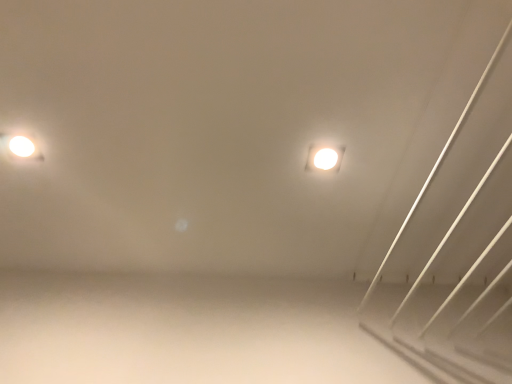
Question: Is the position of white glossy light fixture at upper center, the 1th lamp when ordered from right to left, more distant than that of matte white light fixture at upper left, which ranks as the second lamp in right-to-left order?

Choices:
 (A) no
 (B) yes

Answer: (B)

Question: Are white glossy light fixture at upper center, acting as the 2th lamp starting from the left, and matte white light fixture at upper left, which ranks as the second lamp in right-to-left order, making contact?

Choices:
 (A) yes
 (B) no

Answer: (B)

Question: Is white glossy light fixture at upper center, acting as the 2th lamp starting from the left, smaller than matte white light fixture at upper left, which is the first lamp in left-to-right order?

Choices:
 (A) yes
 (B) no

Answer: (A)

Question: Considering the relative positions of white glossy light fixture at upper center, acting as the 2th lamp starting from the left, and matte white light fixture at upper left, which ranks as the second lamp in right-to-left order, in the image provided, is white glossy light fixture at upper center, acting as the 2th lamp starting from the left, in front of matte white light fixture at upper left, which ranks as the second lamp in right-to-left order,?

Choices:
 (A) no
 (B) yes

Answer: (A)

Question: Is matte white light fixture at upper left, which is the first lamp in left-to-right order, at the back of white glossy light fixture at upper center, acting as the 2th lamp starting from the left?

Choices:
 (A) yes
 (B) no

Answer: (B)

Question: From a real-world perspective, is white glossy light fixture at upper center, the 1th lamp when ordered from right to left, positioned over matte white light fixture at upper left, which ranks as the second lamp in right-to-left order, based on gravity?

Choices:
 (A) no
 (B) yes

Answer: (A)

Question: Is matte white light fixture at upper left, which ranks as the second lamp in right-to-left order, not inside white glossy light fixture at upper center, acting as the 2th lamp starting from the left?

Choices:
 (A) no
 (B) yes

Answer: (B)

Question: Considering the relative sizes of matte white light fixture at upper left, which is the first lamp in left-to-right order, and white glossy light fixture at upper center, the 1th lamp when ordered from right to left, in the image provided, is matte white light fixture at upper left, which is the first lamp in left-to-right order, wider than white glossy light fixture at upper center, the 1th lamp when ordered from right to left,?

Choices:
 (A) yes
 (B) no

Answer: (B)

Question: From the image's perspective, does matte white light fixture at upper left, which ranks as the second lamp in right-to-left order, appear higher than white glossy light fixture at upper center, acting as the 2th lamp starting from the left?

Choices:
 (A) yes
 (B) no

Answer: (A)

Question: Considering the relative sizes of matte white light fixture at upper left, which is the first lamp in left-to-right order, and white glossy light fixture at upper center, the 1th lamp when ordered from right to left, in the image provided, is matte white light fixture at upper left, which is the first lamp in left-to-right order, bigger than white glossy light fixture at upper center, the 1th lamp when ordered from right to left,?

Choices:
 (A) no
 (B) yes

Answer: (B)

Question: Is matte white light fixture at upper left, which ranks as the second lamp in right-to-left order, at the right side of white glossy light fixture at upper center, the 1th lamp when ordered from right to left?

Choices:
 (A) yes
 (B) no

Answer: (B)

Question: Is there a large distance between matte white light fixture at upper left, which is the first lamp in left-to-right order, and white glossy light fixture at upper center, the 1th lamp when ordered from right to left?

Choices:
 (A) no
 (B) yes

Answer: (A)

Question: Relative to white glossy light fixture at upper center, acting as the 2th lamp starting from the left, is matte white light fixture at upper left, which ranks as the second lamp in right-to-left order, in front or behind?

Choices:
 (A) front
 (B) behind

Answer: (A)